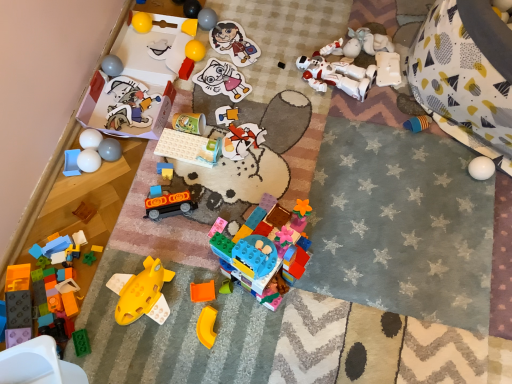
Find the location of a particular element. The image size is (512, 384). vacant area that lies to the right of white glossy ball at left, the nineteenth toy in the right-to-left sequence is located at coordinates (142, 164).